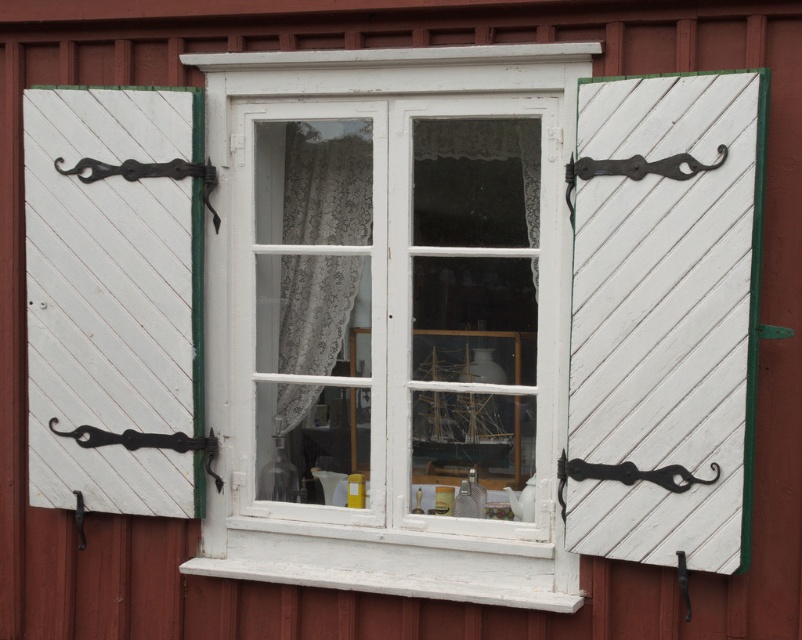
Question: Is white wood at left wider than lacy fabric curtain at center?

Choices:
 (A) no
 (B) yes

Answer: (B)

Question: Which object appears closest to the camera in this image?

Choices:
 (A) black metal hook at lower right
 (B) white wood at left
 (C) lacy fabric curtain at center
 (D) black metal hook at left

Answer: (A)

Question: Does white wood window frame at center appear under black metal hook at lower right?

Choices:
 (A) yes
 (B) no

Answer: (B)

Question: Among these objects, which one is nearest to the camera?

Choices:
 (A) black metal hook at lower right
 (B) white painted wood at right

Answer: (B)

Question: From the image, what is the correct spatial relationship of white wood at left in relation to black metal hook at lower right?

Choices:
 (A) right
 (B) left

Answer: (B)

Question: Which point is closer to the camera?

Choices:
 (A) (79, 492)
 (B) (715, 436)

Answer: (B)